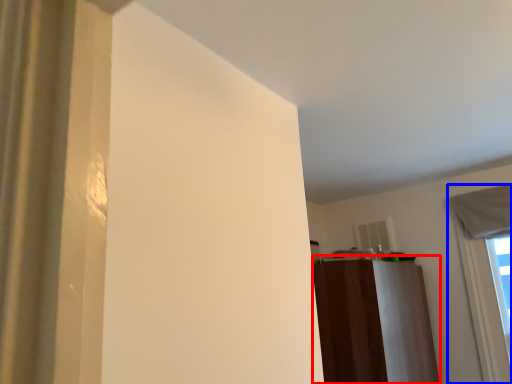
Question: Among these objects, which one is nearest to the camera, dresser (highlighted by a red box) or window (highlighted by a blue box)?

Choices:
 (A) dresser
 (B) window

Answer: (A)